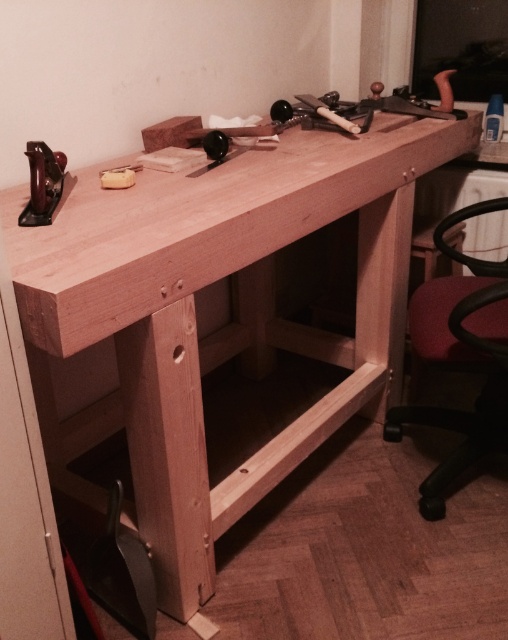
Question: Among these points, which one is nearest to the camera?

Choices:
 (A) (43, 198)
 (B) (187, 292)

Answer: (B)

Question: Can you confirm if natural wood counter top at center is smaller than matte black plane at left?

Choices:
 (A) no
 (B) yes

Answer: (A)

Question: Is natural wood counter top at center smaller than matte black plane at left?

Choices:
 (A) yes
 (B) no

Answer: (B)

Question: Can you confirm if natural wood counter top at center is positioned to the right of matte black plane at left?

Choices:
 (A) no
 (B) yes

Answer: (B)